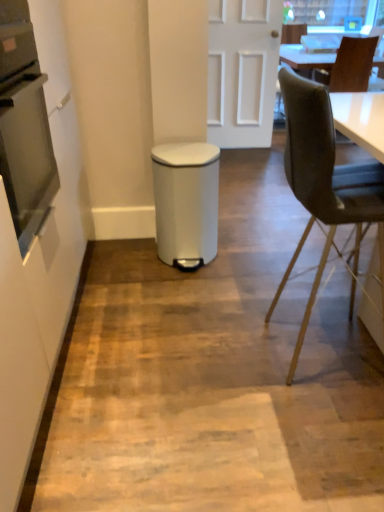
In order to click on free spot in front of white plastic waste bin at center in this screenshot , I will do `click(197, 289)`.